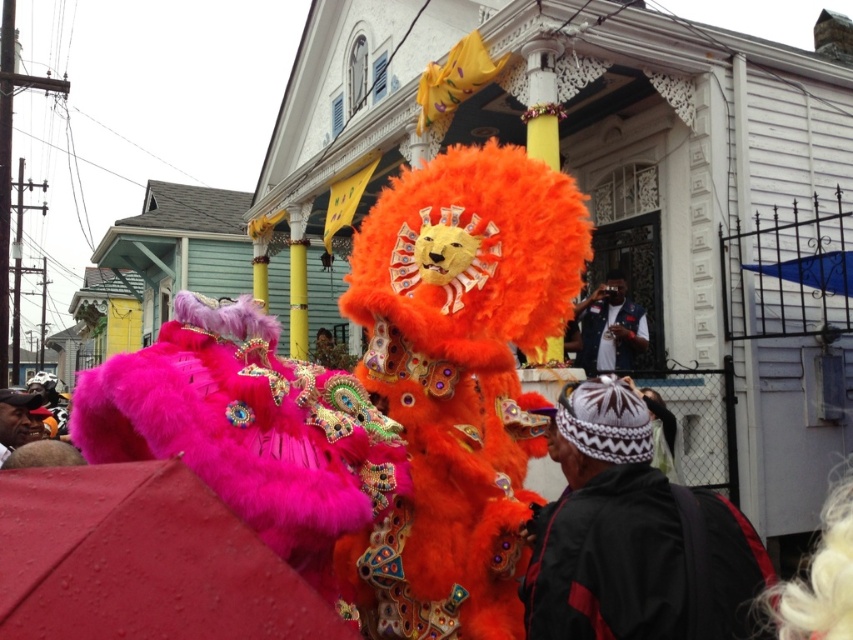
This screenshot has width=853, height=640. I want to click on velvet black jacket at center, so click(x=631, y=536).

Based on the photo, is velvet black jacket at center below denim vest at center?

Indeed, velvet black jacket at center is positioned under denim vest at center.

Does point (683, 620) come in front of point (601, 336)?

Yes, point (683, 620) is in front of point (601, 336).

The height and width of the screenshot is (640, 853). What are the coordinates of `velvet black jacket at center` in the screenshot? It's located at (631, 536).

What do you see at coordinates (248, 428) in the screenshot? The height and width of the screenshot is (640, 853). I see `fuzzy pink costume at center` at bounding box center [248, 428].

Between point (316, 577) and point (30, 410), which one is positioned behind?

The point (30, 410) is behind.

Locate an element on the screen. fuzzy pink costume at center is located at coordinates (248, 428).

Is point (308, 460) in front of point (743, 588)?

Yes, point (308, 460) is in front of point (743, 588).

Where is `fuzzy pink costume at center`? The height and width of the screenshot is (640, 853). fuzzy pink costume at center is located at coordinates (248, 428).